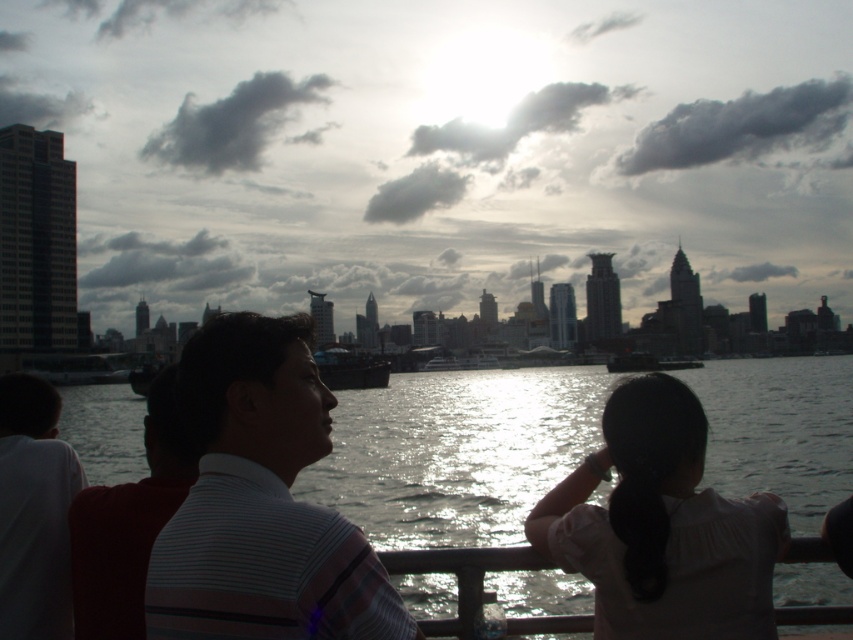
Question: Is white matte shirt at center above white striped shirt at center?

Choices:
 (A) yes
 (B) no

Answer: (B)

Question: Which point is farther to the camera?

Choices:
 (A) (9, 531)
 (B) (83, 589)
 (C) (695, 577)

Answer: (A)

Question: Estimate the real-world distances between objects in this image. Which object is closer to the striped cotton shirt at center?

Choices:
 (A) glistening water at center
 (B) white striped shirt at center
 (C) white matte shirt at left
 (D) white matte shirt at center

Answer: (B)

Question: Does striped cotton shirt at center have a larger size compared to white matte shirt at left?

Choices:
 (A) no
 (B) yes

Answer: (B)

Question: Among these objects, which one is nearest to the camera?

Choices:
 (A) glistening water at center
 (B) white matte shirt at left

Answer: (B)

Question: From the image, what is the correct spatial relationship of glistening water at center in relation to white matte shirt at left?

Choices:
 (A) left
 (B) right

Answer: (B)